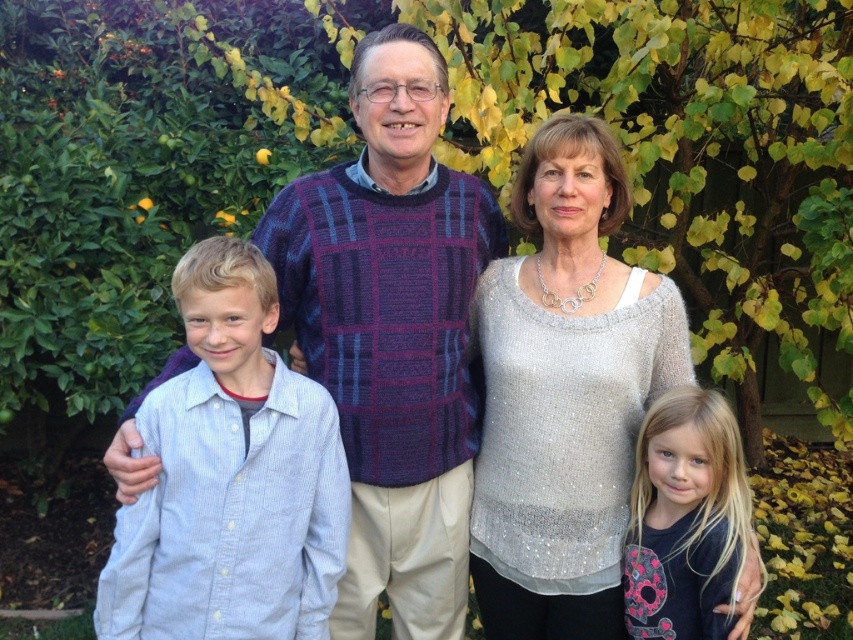
Question: Can you confirm if silver sequined top at center is positioned to the right of blonde hair at center?

Choices:
 (A) no
 (B) yes

Answer: (A)

Question: Which point is farther from the camera taking this photo?

Choices:
 (A) (706, 570)
 (B) (518, 356)

Answer: (B)

Question: Which point is farther from the camera taking this photo?

Choices:
 (A) (659, 525)
 (B) (450, 216)

Answer: (B)

Question: Is plaid sweater at center bigger than silver sequined top at center?

Choices:
 (A) no
 (B) yes

Answer: (B)

Question: Does silver sequined top at center have a lesser width compared to light blue striped shirt at center?

Choices:
 (A) no
 (B) yes

Answer: (A)

Question: Which of these objects is positioned closest to the blonde hair at center?

Choices:
 (A) plaid sweater at center
 (B) silver sequined top at center
 (C) light blue striped shirt at center

Answer: (B)